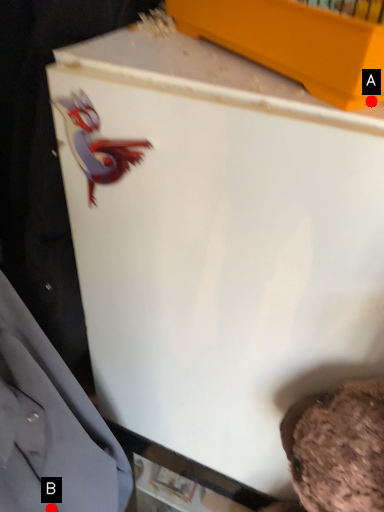
Question: Two points are circled on the image, labeled by A and B beside each circle. Which point is further to the camera?

Choices:
 (A) A is further
 (B) B is further

Answer: (B)